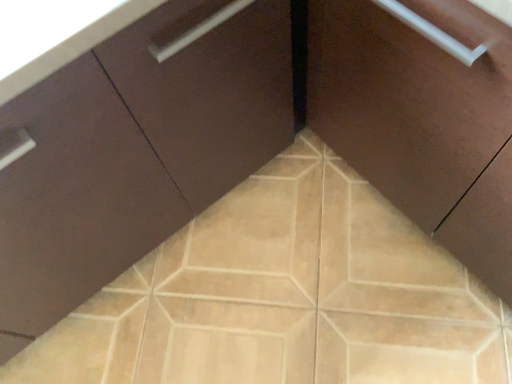
Question: From a real-world perspective, is matte brown cabinet at center, arranged as the 1th cabinetry when viewed from the right, physically located above or below beige ceramic tile at center?

Choices:
 (A) above
 (B) below

Answer: (A)

Question: Considering the positions of matte brown cabinet at center, arranged as the 1th cabinetry when viewed from the right, and beige ceramic tile at center in the image, is matte brown cabinet at center, arranged as the 1th cabinetry when viewed from the right, taller or shorter than beige ceramic tile at center?

Choices:
 (A) short
 (B) tall

Answer: (B)

Question: Which object is the closest to the matte brown cabinet at center, which appears as the 1th cabinetry when viewed from the left?

Choices:
 (A) beige ceramic tile at center
 (B) matte brown cabinet at center, which is the second cabinetry from left to right

Answer: (A)

Question: Estimate the real-world distances between objects in this image. Which object is farther from the beige ceramic tile at center?

Choices:
 (A) matte brown cabinet at center, the 2th cabinetry viewed from the right
 (B) matte brown cabinet at center, which is the second cabinetry from left to right

Answer: (B)